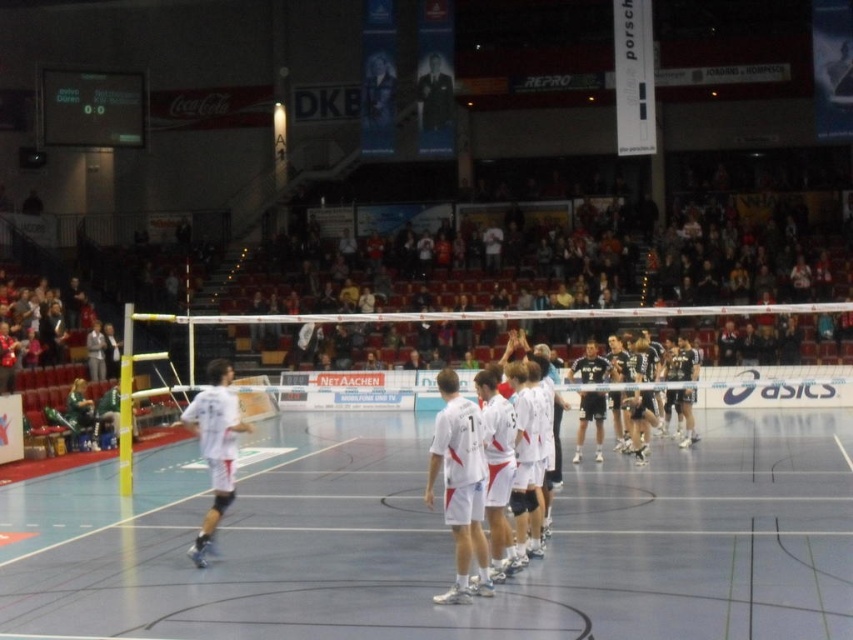
Based on the photo, you are standing at the edge of the court and want to take a photo of the white synthetic court at center. If your camera can focus up to 10 meters, will you be able to capture the court clearly?

The white synthetic court at center is 8.00 meters away from the camera, which is within the camera focus range of up to 10 meters. Therefore, you can capture the court clearly.

You are a volleyball player positioned at the center of the court. You need to decide which direction to move to reach the ball first. The ball is at one of the two points labeled as point (x=305, y=620) or point (x=468, y=452). Based on their positions, which point is closer to you?

Point (x=305, y=620) is in front of point (x=468, y=452), so it is closer to you.